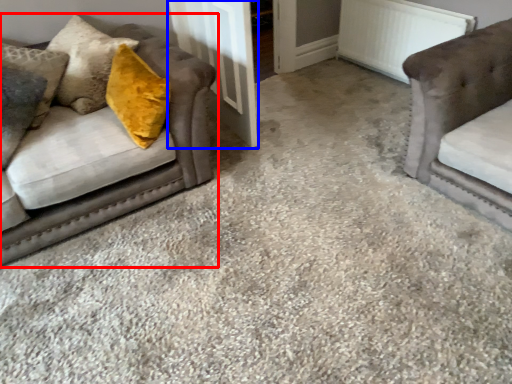
Question: Which point is further to the camera, studio couch (highlighted by a red box) or door (highlighted by a blue box)?

Choices:
 (A) studio couch
 (B) door

Answer: (B)